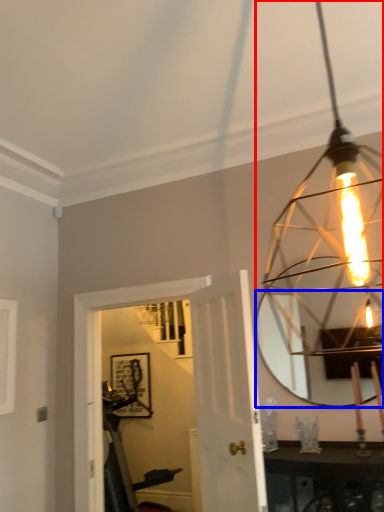
Question: Which point is further to the camera, lamp (highlighted by a red box) or mirror (highlighted by a blue box)?

Choices:
 (A) lamp
 (B) mirror

Answer: (B)